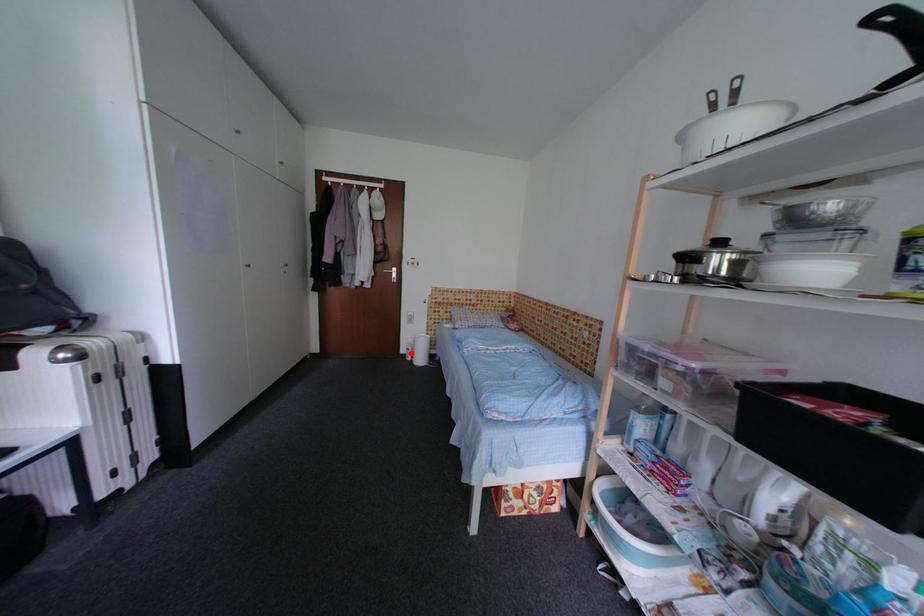
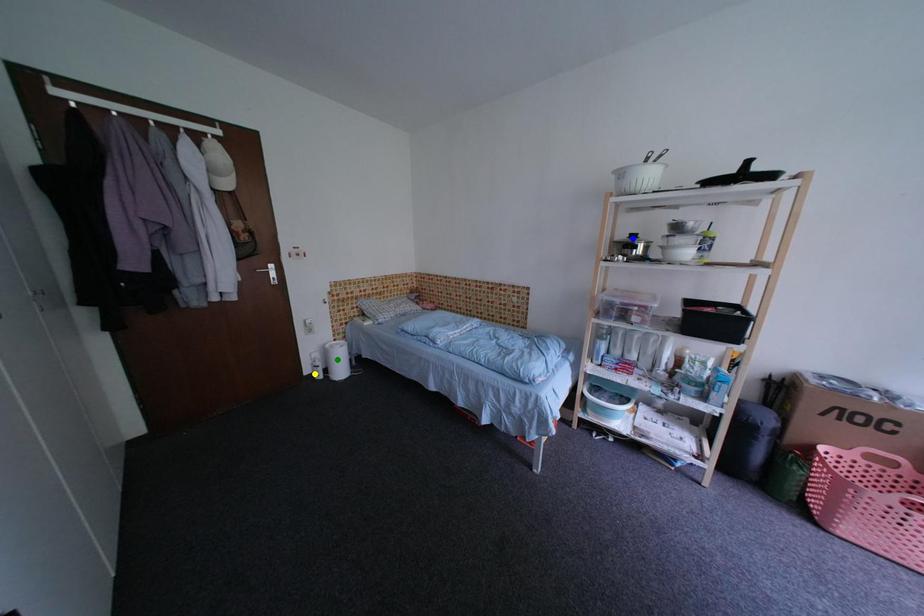
Question: I am providing you with two images of the same scene from different viewpoints. A red point is marked on the first image. You are given multiple points on the second image. In image 2, which mark is for the same physical point as the one in image 1?

Choices:
 (A) green point
 (B) yellow point
 (C) blue point

Answer: (B)